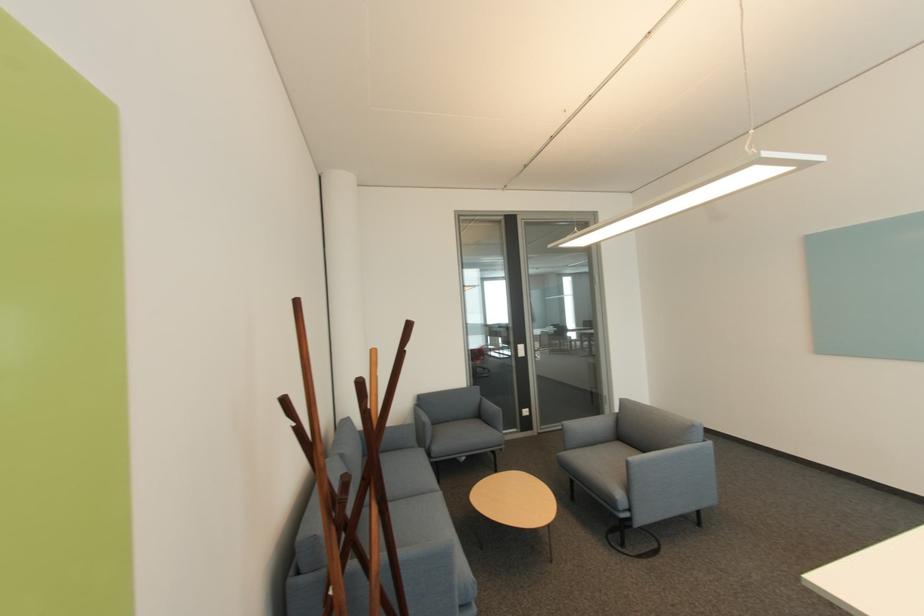
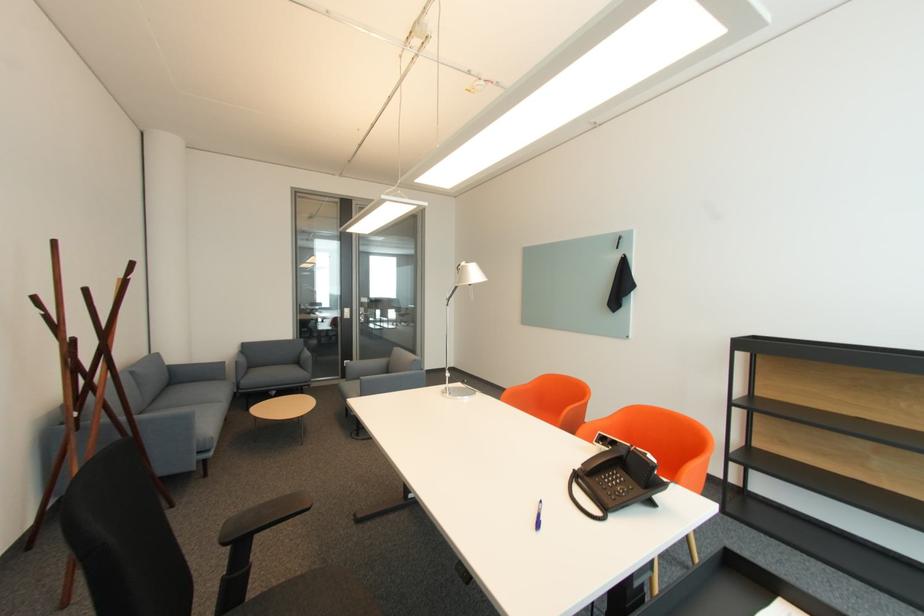
Find the pixel in the second image that matches [305,429] in the first image.

(53, 315)